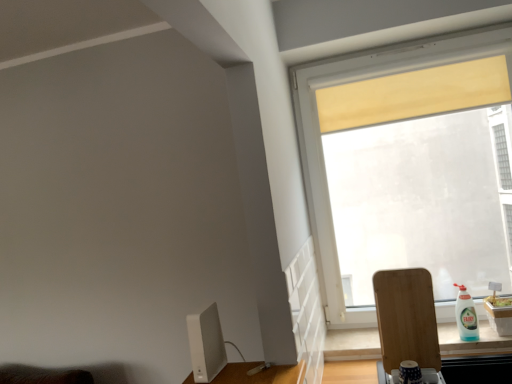
Question: Should I look upward or downward to see wooden cutting board at lower right?

Choices:
 (A) down
 (B) up

Answer: (A)

Question: From the image's perspective, is wooden cutting board at lower right below white matte computer monitor at lower left?

Choices:
 (A) no
 (B) yes

Answer: (B)

Question: From a real-world perspective, does wooden cutting board at lower right stand above white matte computer monitor at lower left?

Choices:
 (A) no
 (B) yes

Answer: (A)

Question: Is wooden cutting board at lower right next to white matte computer monitor at lower left and touching it?

Choices:
 (A) yes
 (B) no

Answer: (B)

Question: Can you confirm if wooden cutting board at lower right is thinner than white matte computer monitor at lower left?

Choices:
 (A) yes
 (B) no

Answer: (A)

Question: Considering the relative sizes of wooden cutting board at lower right and white matte computer monitor at lower left in the image provided, is wooden cutting board at lower right taller than white matte computer monitor at lower left?

Choices:
 (A) no
 (B) yes

Answer: (B)

Question: Is wooden cutting board at lower right positioned beyond the bounds of white matte computer monitor at lower left?

Choices:
 (A) no
 (B) yes

Answer: (B)

Question: Is wooden cutting board at lower right located within white matte computer monitor at lower left?

Choices:
 (A) yes
 (B) no

Answer: (B)

Question: Does white matte computer monitor at lower left have a lesser width compared to wooden cutting board at lower right?

Choices:
 (A) yes
 (B) no

Answer: (B)

Question: Is white matte computer monitor at lower left completely or partially outside of wooden cutting board at lower right?

Choices:
 (A) no
 (B) yes

Answer: (B)

Question: From the image's perspective, is white matte computer monitor at lower left located beneath wooden cutting board at lower right?

Choices:
 (A) yes
 (B) no

Answer: (B)

Question: From a real-world perspective, is white matte computer monitor at lower left beneath wooden cutting board at lower right?

Choices:
 (A) yes
 (B) no

Answer: (B)

Question: From a real-world perspective, is white matte computer monitor at lower left positioned over wooden cutting board at lower right based on gravity?

Choices:
 (A) no
 (B) yes

Answer: (B)

Question: Does white plastic bottle at right turn towards transparent glass window at upper right?

Choices:
 (A) yes
 (B) no

Answer: (B)